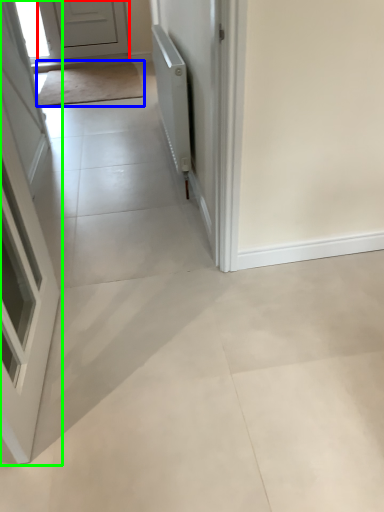
Question: Which is nearer to the door (highlighted by a red box)? mat (highlighted by a blue box) or door (highlighted by a green box).

Choices:
 (A) mat
 (B) door

Answer: (A)